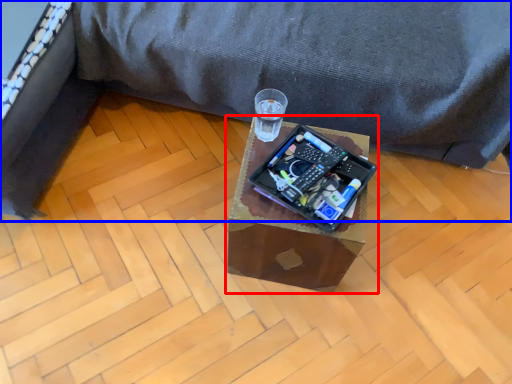
Question: Which object appears closest to the camera in this image, table (highlighted by a red box) or furniture (highlighted by a blue box)?

Choices:
 (A) table
 (B) furniture

Answer: (B)